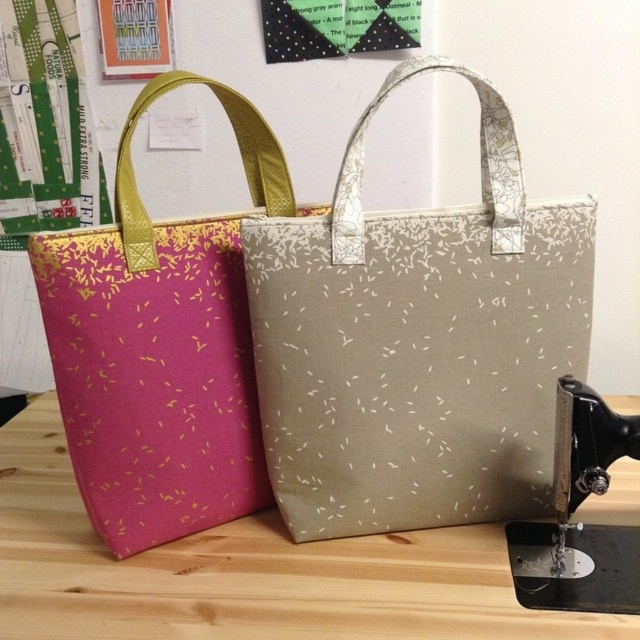
Is matte beige tote at center to the right of pink fabric tote at left from the viewer's perspective?

Indeed, matte beige tote at center is positioned on the right side of pink fabric tote at left.

Who is more distant from viewer, [424,444] or [125,241]?

Positioned behind is point [424,444].

Where is `matte beige tote at center`? The image size is (640, 640). matte beige tote at center is located at coordinates (417, 342).

Does matte beige tote at center have a larger size compared to wooden table at center?

Incorrect, matte beige tote at center is not larger than wooden table at center.

Identify the location of matte beige tote at center. The image size is (640, 640). (417, 342).

At what (x,y) coordinates should I click in order to perform the action: click on matte beige tote at center. Please return your answer as a coordinate pair (x, y). Looking at the image, I should click on 417,342.

Does matte beige tote at center have a larger size compared to metallic silver sewing machine at lower right?

Indeed, matte beige tote at center has a larger size compared to metallic silver sewing machine at lower right.

Where is `matte beige tote at center`? The height and width of the screenshot is (640, 640). matte beige tote at center is located at coordinates (417, 342).

Where is `matte beige tote at center`? matte beige tote at center is located at coordinates (417, 342).